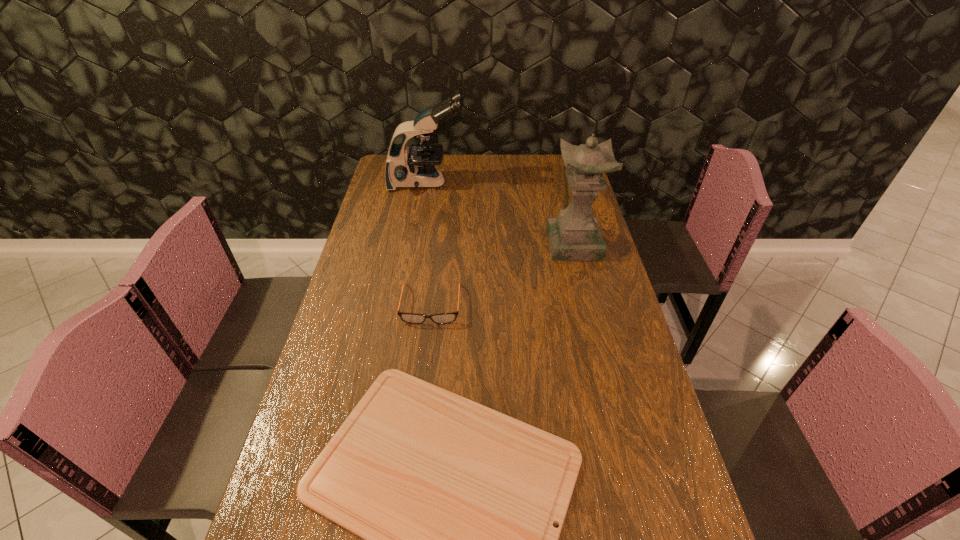
In order to click on object at the right edge in this screenshot , I will do `click(575, 234)`.

You are a GUI agent. You are given a task and a screenshot of the screen. Output one action in this format:
    pyautogui.click(x=<x>, y=<y>)
    Task: Click on the object that is at the far left corner
    The width and height of the screenshot is (960, 540).
    Given the screenshot: What is the action you would take?
    pyautogui.click(x=415, y=168)

You are a GUI agent. You are given a task and a screenshot of the screen. Output one action in this format:
    pyautogui.click(x=<x>, y=<y>)
    Task: Click on the vacant space at the far edge of the desktop
    Image resolution: width=960 pixels, height=540 pixels.
    Given the screenshot: What is the action you would take?
    pyautogui.click(x=524, y=168)

In the image, there is a desktop. Where is `vacant space at the left edge`? The image size is (960, 540). vacant space at the left edge is located at coordinates (373, 233).

In the image, there is a desktop. At what (x,y) coordinates should I click in order to perform the action: click on vacant space at the right edge. Please return your answer as a coordinate pair (x, y). Looking at the image, I should click on (607, 341).

Where is `vacant space at the far right corner`? The height and width of the screenshot is (540, 960). vacant space at the far right corner is located at coordinates (562, 178).

Where is `unoccupied area between the second farthest object and the third tallest object`? This screenshot has height=540, width=960. unoccupied area between the second farthest object and the third tallest object is located at coordinates (503, 274).

I want to click on free space between the farthest object and the third nearest object, so click(x=500, y=213).

In order to click on blank region between the spectacles and the second farthest object in this screenshot , I will do `click(503, 274)`.

What are the coordinates of `free space between the farthest object and the second nearest object` in the screenshot? It's located at (429, 244).